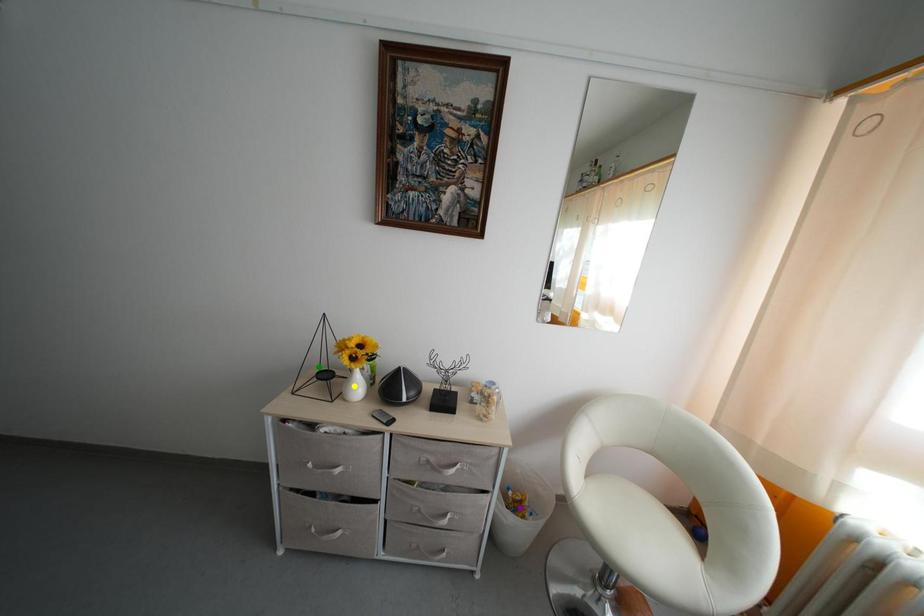
Order these from nearest to farthest:
- purple point
- yellow point
- green point

green point → purple point → yellow point